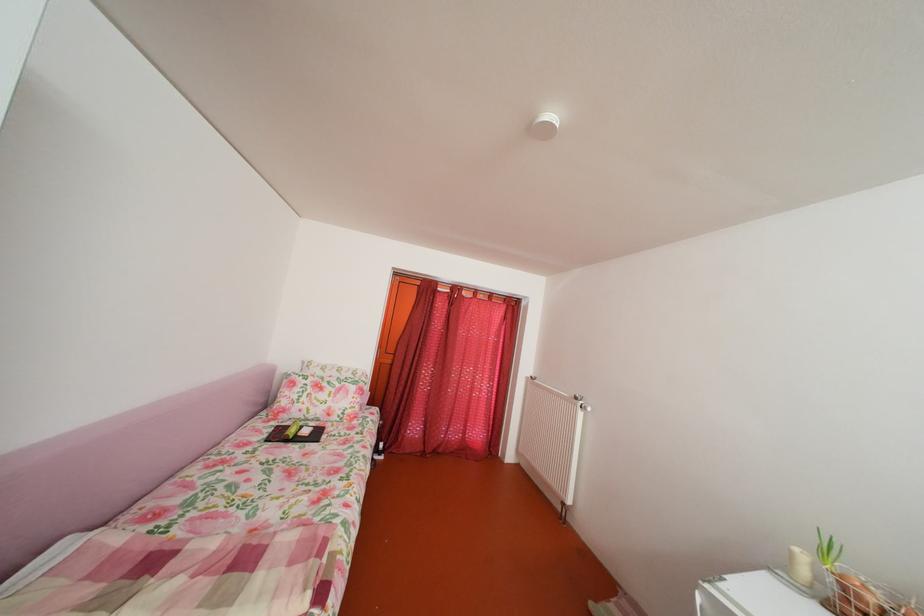
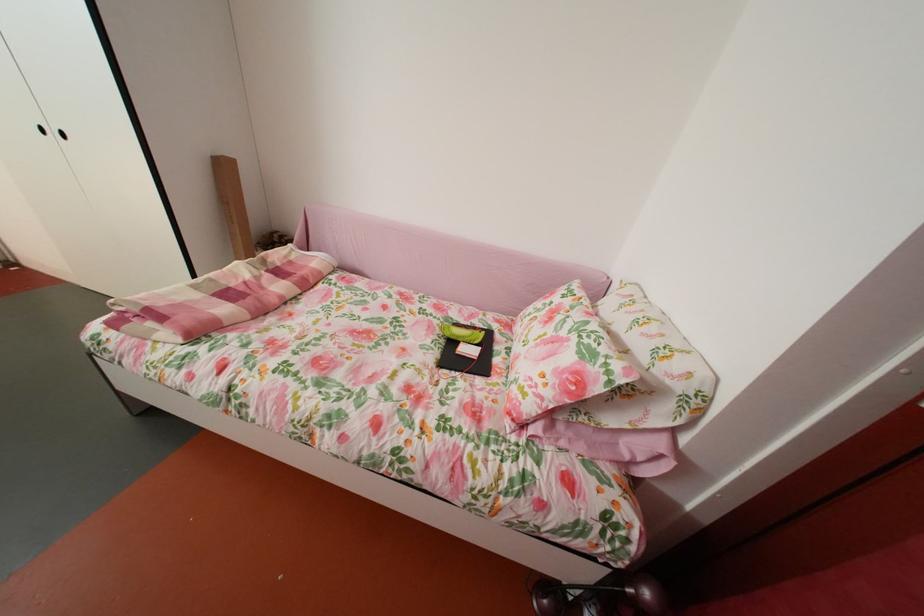
Locate, in the second image, the point that corresponds to point (369, 415) in the first image.

(541, 413)